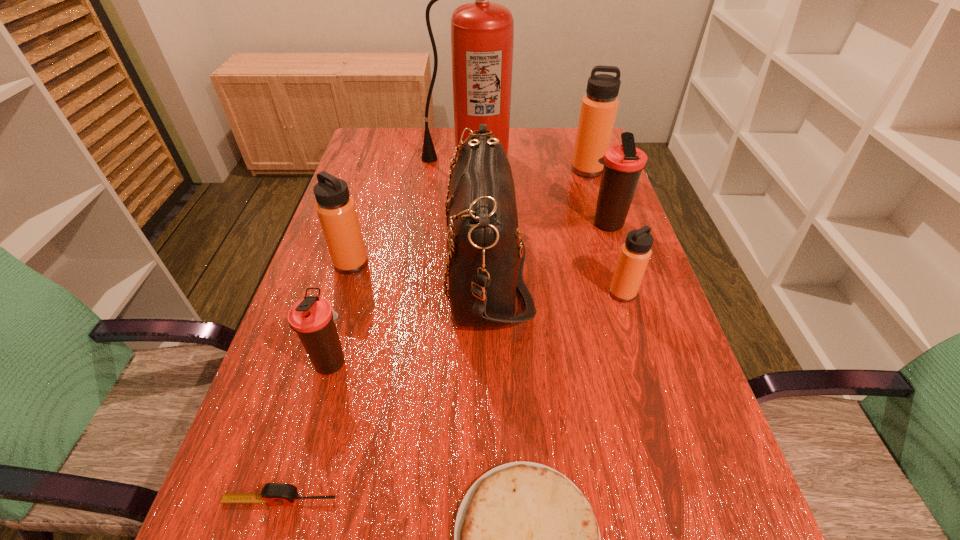
Where is `the tallest object`? the tallest object is located at coordinates (482, 33).

Locate an element on the screen. fire extinguisher is located at coordinates (482, 33).

Where is `the farthest orange thermos bottle`? The image size is (960, 540). the farthest orange thermos bottle is located at coordinates (599, 107).

Where is `the farthest thermos bottle`? This screenshot has width=960, height=540. the farthest thermos bottle is located at coordinates (599, 107).

At what (x,y) coordinates should I click in order to perform the action: click on handbag. Please return your answer as a coordinate pair (x, y). Image resolution: width=960 pixels, height=540 pixels. Looking at the image, I should click on (486, 253).

Where is `the bigger brown thermos bottle`? The height and width of the screenshot is (540, 960). the bigger brown thermos bottle is located at coordinates (623, 164).

Locate an element on the screen. the farther brown thermos bottle is located at coordinates (623, 164).

Locate an element on the screen. The width and height of the screenshot is (960, 540). the second biggest orange thermos bottle is located at coordinates (336, 210).

Find the location of a particular element. The height and width of the screenshot is (540, 960). the second farthest orange thermos bottle is located at coordinates (336, 210).

Find the location of a particular element. the smaller brown thermos bottle is located at coordinates (312, 318).